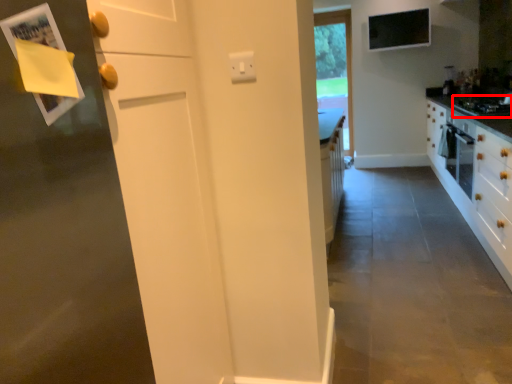
Question: From the image's perspective, what is the correct spatial positioning of gas stove (annotated by the red box) in reference to window?

Choices:
 (A) above
 (B) below

Answer: (B)